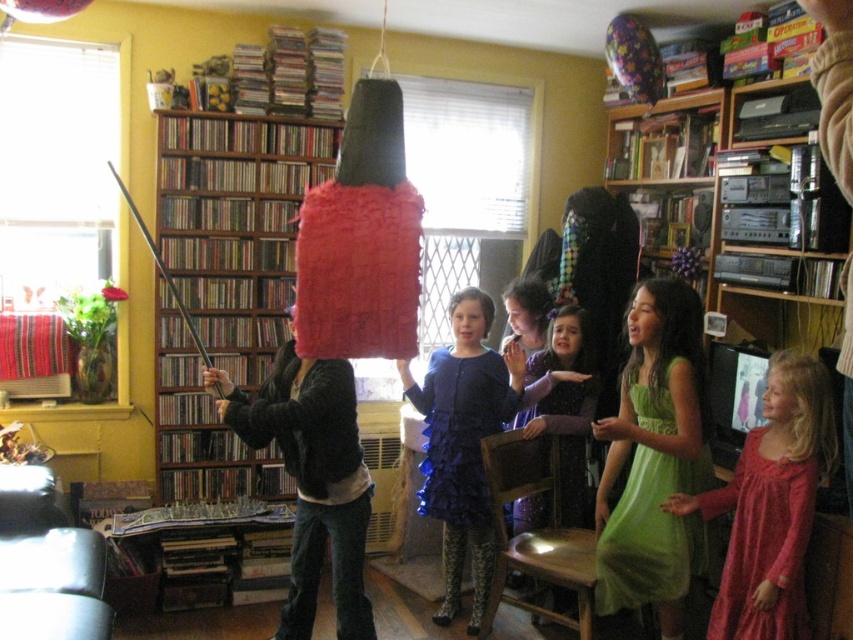
You are a parent trying to decide where to place a new 1.2 meter wide toy box. You see the wooden bookshelf at left and the ruffled blue dress at center. Which object should you place the toy box next to if you want it to be wider than both?

The wooden bookshelf at left might be wider than ruffled blue dress at center, so you should place the toy box next to the wooden bookshelf at left to ensure it is wider than both.